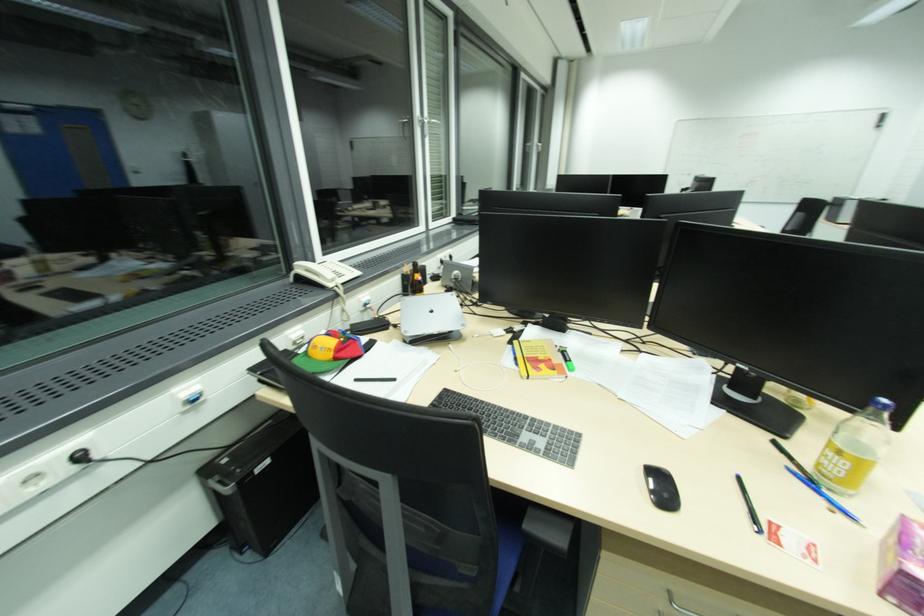
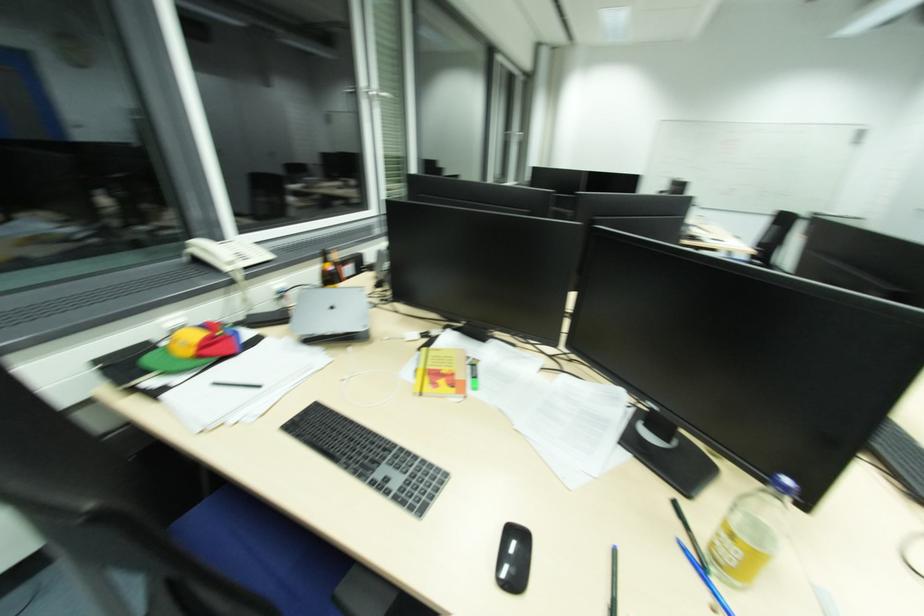
Where in the second image is the point corresponding to (x=653, y=474) from the first image?

(514, 533)